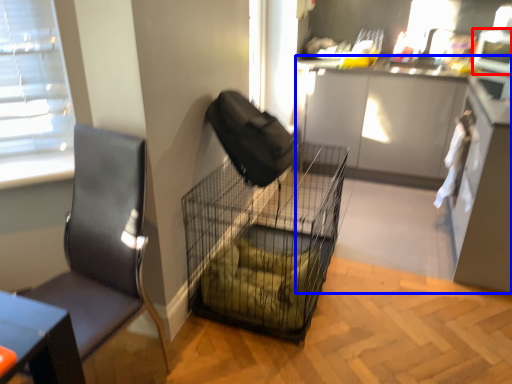
Question: Which of the following is the farthest to the observer, appliance (highlighted by a red box) or cabinetry (highlighted by a blue box)?

Choices:
 (A) appliance
 (B) cabinetry

Answer: (A)